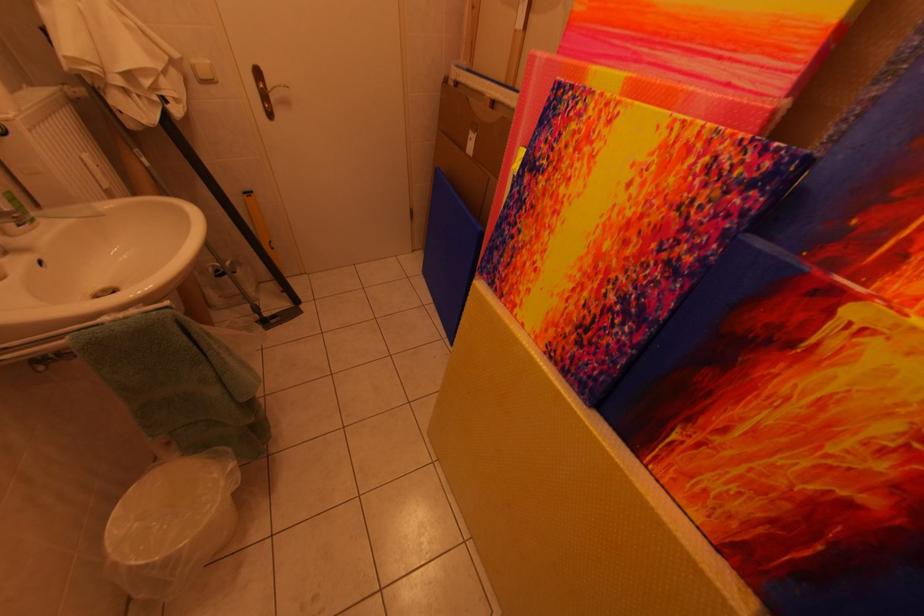
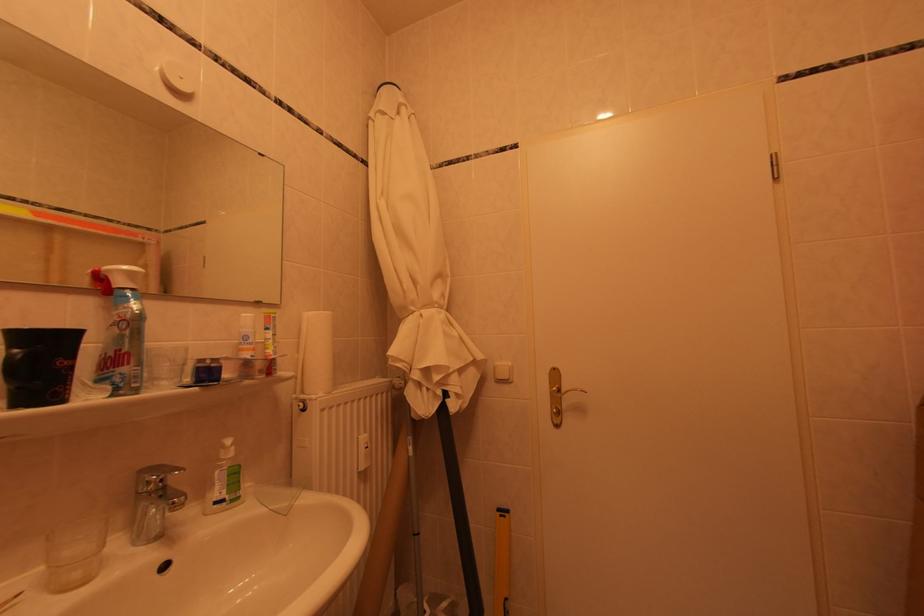
The point at [203,65] is marked in the first image. Where is the corresponding point in the second image?

(506, 367)